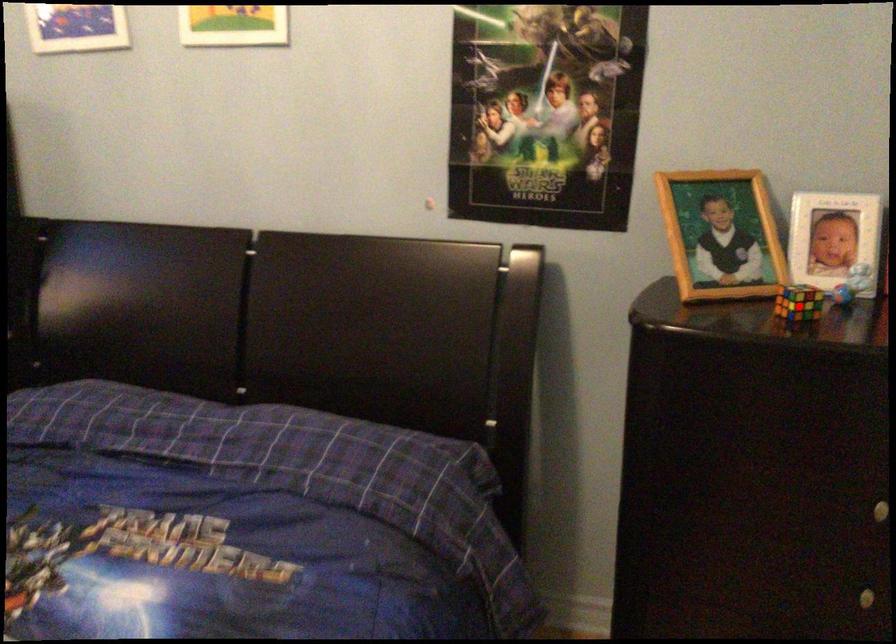
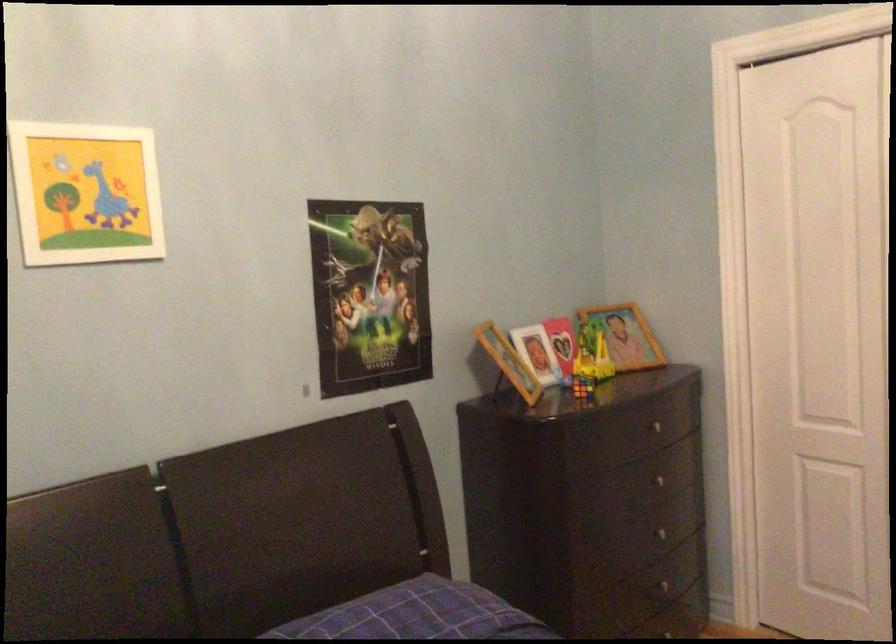
Question: I am providing you with two images of the same scene from different viewpoints. A red point is shown in image1. For the corresponding object point in image2, is it positioned nearer or farther from the camera?

Choices:
 (A) Nearer
 (B) Farther

Answer: (B)